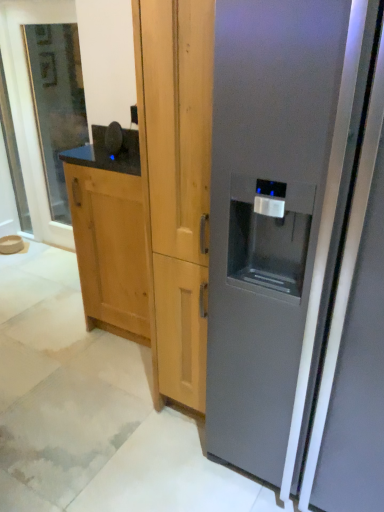
In order to face satin gray refrigerator at right, should I rotate leftwards or rightwards?

Turn right approximately 19.115 degrees to face it.

You are a GUI agent. You are given a task and a screenshot of the screen. Output one action in this format:
    pyautogui.click(x=<x>, y=<y>)
    Task: Click on the satin gray refrigerator at right
    This screenshot has height=512, width=384.
    Given the screenshot: What is the action you would take?
    pyautogui.click(x=278, y=216)

Does satin gray refrigerator at right turn towards natural wood cabinet at left?

No, satin gray refrigerator at right is not oriented towards natural wood cabinet at left.

Which is less distant, (304,331) or (124,300)?

Point (304,331) appears to be closer to the viewer than point (124,300).

From the image's perspective, which one is positioned higher, satin gray refrigerator at right or natural wood cabinet at left?

natural wood cabinet at left is shown above in the image.

Is satin gray refrigerator at right spatially inside natural wood cabinet at left, or outside of it?

satin gray refrigerator at right cannot be found inside natural wood cabinet at left.

How many degrees apart are the facing directions of clear glass door at left and natural wood cabinet at left?

They differ by 1.06 degrees in their facing directions.

Is clear glass door at left turned away from natural wood cabinet at left?

No, natural wood cabinet at left is not at the back of clear glass door at left.

In the scene shown: Is the position of clear glass door at left more distant than that of natural wood cabinet at left?

Yes, it is.

Is clear glass door at left smaller than natural wood cabinet at left?

Correct, clear glass door at left occupies less space than natural wood cabinet at left.

Is clear glass door at left closer to the viewer compared to satin gray refrigerator at right?

No, clear glass door at left is further to the viewer.

From the picture: Between clear glass door at left and satin gray refrigerator at right, which one has smaller size?

clear glass door at left is smaller.

Looking at this image, in terms of height, does clear glass door at left look taller or shorter compared to satin gray refrigerator at right?

In the image, clear glass door at left appears to be taller than satin gray refrigerator at right.

Is natural wood cabinet at left next to clear glass door at left and touching it?

There is a gap between natural wood cabinet at left and clear glass door at left.

From a real-world perspective, is natural wood cabinet at left above or below clear glass door at left?

Clearly, from a real-world perspective, natural wood cabinet at left is below clear glass door at left.

Between natural wood cabinet at left and clear glass door at left, which one has more height?

With more height is clear glass door at left.

Considering the positions of point (119, 244) and point (59, 172), is point (119, 244) closer or farther from the camera than point (59, 172)?

Point (119, 244) is closer to the camera than point (59, 172).

Looking at their sizes, would you say natural wood cabinet at left is wider or thinner than satin gray refrigerator at right?

Considering their sizes, natural wood cabinet at left looks slimmer than satin gray refrigerator at right.

Based on their sizes in the image, would you say natural wood cabinet at left is bigger or smaller than satin gray refrigerator at right?

In the image, natural wood cabinet at left appears to be smaller than satin gray refrigerator at right.

Considering the relative positions of natural wood cabinet at left and satin gray refrigerator at right in the image provided, is natural wood cabinet at left in front of satin gray refrigerator at right?

No, natural wood cabinet at left is behind satin gray refrigerator at right.

Are natural wood cabinet at left and satin gray refrigerator at right beside each other?

No, natural wood cabinet at left is not in contact with satin gray refrigerator at right.

Which is more to the right, satin gray refrigerator at right or clear glass door at left?

From the viewer's perspective, satin gray refrigerator at right appears more on the right side.

Is satin gray refrigerator at right further to the viewer compared to clear glass door at left?

No, satin gray refrigerator at right is closer to the camera.

Between satin gray refrigerator at right and clear glass door at left, which one has smaller size?

With smaller size is clear glass door at left.

Is satin gray refrigerator at right taller than clear glass door at left?

In fact, satin gray refrigerator at right may be shorter than clear glass door at left.

I want to click on refrigerator in front of the natural wood cabinet at left, so click(x=278, y=216).

The width and height of the screenshot is (384, 512). What are the coordinates of `glass door above the natural wood cabinet at left (from the image's perspective)` in the screenshot? It's located at (56, 103).

Which object lies nearer to the anchor point satin gray refrigerator at right, clear glass door at left or natural wood cabinet at left?

The object closer to satin gray refrigerator at right is natural wood cabinet at left.

Looking at this image, which object lies further to the anchor point satin gray refrigerator at right, natural wood cabinet at left or clear glass door at left?

clear glass door at left lies further to satin gray refrigerator at right than the other object.

Looking at the image, which one is located closer to clear glass door at left, natural wood cabinet at left or satin gray refrigerator at right?

The object closer to clear glass door at left is natural wood cabinet at left.

When comparing their distances from clear glass door at left, does satin gray refrigerator at right or natural wood cabinet at left seem closer?

Among the two, natural wood cabinet at left is located nearer to clear glass door at left.

When comparing their distances from natural wood cabinet at left, does clear glass door at left or satin gray refrigerator at right seem closer?

satin gray refrigerator at right lies closer to natural wood cabinet at left than the other object.

Looking at the image, which one is located closer to natural wood cabinet at left, satin gray refrigerator at right or clear glass door at left?

satin gray refrigerator at right.

Locate an element on the screen. This screenshot has height=512, width=384. cabinetry located between satin gray refrigerator at right and clear glass door at left in the depth direction is located at coordinates (110, 246).